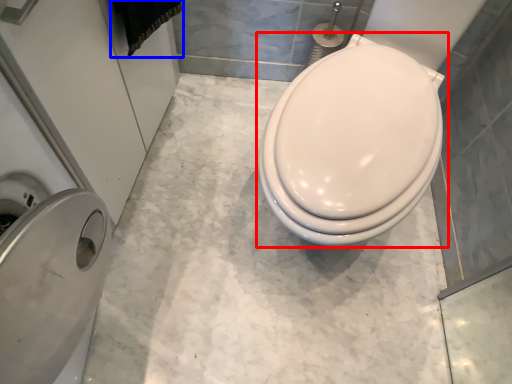
Question: Which object appears closest to the camera in this image, toilet (highlighted by a red box) or material (highlighted by a blue box)?

Choices:
 (A) toilet
 (B) material

Answer: (A)